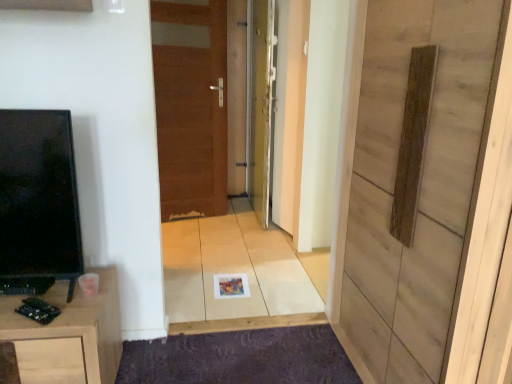
The height and width of the screenshot is (384, 512). Describe the element at coordinates (68, 335) in the screenshot. I see `wooden cabinet at lower left` at that location.

What do you see at coordinates (240, 358) in the screenshot? I see `purple textured mat at lower center` at bounding box center [240, 358].

The width and height of the screenshot is (512, 384). I want to click on metallic silver door at center, acting as the 2th door starting from the front, so click(261, 104).

Where is `wooden panel at center, arranged as the first door when viewed from the front`? wooden panel at center, arranged as the first door when viewed from the front is located at coordinates (420, 184).

What's the angular difference between brown wooden door at center, positioned as the 1th door in back-to-front order, and metallic silver door at center, which is the second door in left-to-right order,'s facing directions?

102 degrees.

Is brown wooden door at center, positioned as the 1th door in back-to-front order, thinner than metallic silver door at center, which is the second door in back-to-front order?

Indeed, brown wooden door at center, positioned as the 1th door in back-to-front order, has a lesser width compared to metallic silver door at center, which is the second door in back-to-front order.

Does brown wooden door at center, which is the 1th door in left-to-right order, appear on the right side of metallic silver door at center, which is the second door in back-to-front order?

No, brown wooden door at center, which is the 1th door in left-to-right order, is not to the right of metallic silver door at center, which is the second door in back-to-front order.

Measure the distance from brown wooden door at center, positioned as the 1th door in back-to-front order, to metallic silver door at center, which is the second door in left-to-right order.

A distance of 19.61 inches exists between brown wooden door at center, positioned as the 1th door in back-to-front order, and metallic silver door at center, which is the second door in left-to-right order.

Which of these two, wooden cabinet at lower left or wooden panel at center, which is counted as the third door, starting from the back, stands taller?

With more height is wooden panel at center, which is counted as the third door, starting from the back.

Does wooden cabinet at lower left have a lesser width compared to wooden panel at center, which is counted as the third door, starting from the back?

Yes.

Considering the relative sizes of wooden cabinet at lower left and wooden panel at center, which is counted as the third door, starting from the back, in the image provided, is wooden cabinet at lower left smaller than wooden panel at center, which is counted as the third door, starting from the back,?

Indeed, wooden cabinet at lower left has a smaller size compared to wooden panel at center, which is counted as the third door, starting from the back.

Considering the points (110, 332) and (303, 359), which point is behind, point (110, 332) or point (303, 359)?

Point (303, 359)

You are a GUI agent. You are given a task and a screenshot of the screen. Output one action in this format:
    pyautogui.click(x=<x>, y=<y>)
    Task: Click on the cabinetry in front of the purple textured mat at lower center
    
    Given the screenshot: What is the action you would take?
    pyautogui.click(x=68, y=335)

Between wooden cabinet at lower left and purple textured mat at lower center, which one has less height?

purple textured mat at lower center is shorter.

From a real-world perspective, starting from the purple textured mat at lower center, which door is the 3rd one vertically above it? Please provide its 2D coordinates.

[(261, 104)]

Is point (195, 375) farther from camera compared to point (270, 15)?

No.

Can you tell me how much purple textured mat at lower center and metallic silver door at center, which is the second door in left-to-right order, differ in facing direction?

89.8 degrees.

Is purple textured mat at lower center bigger or smaller than metallic silver door at center, which is the second door in left-to-right order?

Clearly, purple textured mat at lower center is smaller in size than metallic silver door at center, which is the second door in left-to-right order.

Which point is more forward, (262, 207) or (156, 345)?

Positioned in front is point (156, 345).

Is the position of metallic silver door at center, which appears as the second door when viewed from the right, more distant than that of purple textured mat at lower center?

Yes, it is behind purple textured mat at lower center.

From the image's perspective, which is above, metallic silver door at center, which is the second door in left-to-right order, or purple textured mat at lower center?

From the image's view, metallic silver door at center, which is the second door in left-to-right order, is above.

Does point (434, 35) lie behind point (60, 316)?

No, (434, 35) is in front of (60, 316).

From a real-world perspective, is wooden panel at center, arranged as the first door when viewed from the front, on wooden cabinet at lower left?

Yes, from a real-world perspective, wooden panel at center, arranged as the first door when viewed from the front, is on top of wooden cabinet at lower left.

Is wooden panel at center, which is counted as the third door, starting from the back, with wooden cabinet at lower left?

→ No, wooden panel at center, which is counted as the third door, starting from the back, is not making contact with wooden cabinet at lower left.

Based on their sizes in the image, would you say wooden panel at center, which is counted as the third door, starting from the back, is bigger or smaller than wooden cabinet at lower left?

wooden panel at center, which is counted as the third door, starting from the back, is bigger than wooden cabinet at lower left.

Locate an element on the screen. The height and width of the screenshot is (384, 512). the 2nd door directly beneath the metallic silver door at center, acting as the 2th door starting from the front (from a real-world perspective) is located at coordinates (420, 184).

Is metallic silver door at center, which is the second door in back-to-front order, not within wooden panel at center, arranged as the first door when viewed from the front?

Yes.

Considering the positions of objects metallic silver door at center, acting as the 2th door starting from the front, and wooden panel at center, which is counted as the third door, starting from the back, in the image provided, who is behind, metallic silver door at center, acting as the 2th door starting from the front, or wooden panel at center, which is counted as the third door, starting from the back,?

→ Positioned behind is metallic silver door at center, acting as the 2th door starting from the front.

From the image's perspective, which is below, metallic silver door at center, which appears as the second door when viewed from the right, or wooden panel at center, the first door when ordered from right to left?

wooden panel at center, the first door when ordered from right to left, appears lower in the image.

Image resolution: width=512 pixels, height=384 pixels. What are the coordinates of `door that is behind the metallic silver door at center, which is the second door in left-to-right order` in the screenshot? It's located at (191, 106).

At what (x,y) coordinates should I click in order to perform the action: click on cabinetry that is below the wooden panel at center, arranged as the first door when viewed from the front (from the image's perspective). Please return your answer as a coordinate pair (x, y). Image resolution: width=512 pixels, height=384 pixels. Looking at the image, I should click on (68, 335).

Which object lies nearer to the anchor point wooden panel at center, the first door when ordered from right to left, metallic silver door at center, which is the second door in back-to-front order, or brown wooden door at center, positioned as the 3th door in right-to-left order?

metallic silver door at center, which is the second door in back-to-front order, is closer to wooden panel at center, the first door when ordered from right to left.

Estimate the real-world distances between objects in this image. Which object is closer to wooden cabinet at lower left, purple textured mat at lower center or wooden panel at center, the first door when ordered from right to left?

purple textured mat at lower center is closer to wooden cabinet at lower left.

Which object lies nearer to the anchor point brown wooden door at center, positioned as the 3th door in right-to-left order, wooden panel at center, which is counted as the third door, starting from the back, or purple textured mat at lower center?

The object closer to brown wooden door at center, positioned as the 3th door in right-to-left order, is purple textured mat at lower center.

Based on the photo, looking at the image, which one is located closer to wooden cabinet at lower left, metallic silver door at center, which appears as the second door when viewed from the right, or purple textured mat at lower center?

purple textured mat at lower center is closer to wooden cabinet at lower left.

Based on their spatial positions, is purple textured mat at lower center or wooden panel at center, which is counted as the third door, starting from the back, further from metallic silver door at center, which is the second door in left-to-right order?

The object further to metallic silver door at center, which is the second door in left-to-right order, is wooden panel at center, which is counted as the third door, starting from the back.

Estimate the real-world distances between objects in this image. Which object is further from wooden cabinet at lower left, brown wooden door at center, which is the 1th door in left-to-right order, or wooden panel at center, arranged as the first door when viewed from the front?

brown wooden door at center, which is the 1th door in left-to-right order, is positioned further to the anchor wooden cabinet at lower left.

Based on their spatial positions, is brown wooden door at center, which is the 1th door in left-to-right order, or metallic silver door at center, acting as the 2th door starting from the front, closer to purple textured mat at lower center?

Based on the image, metallic silver door at center, acting as the 2th door starting from the front, appears to be nearer to purple textured mat at lower center.

Consider the image. Looking at the image, which one is located further to brown wooden door at center, placed as the third door when sorted from front to back, wooden panel at center, which is counted as the third door, starting from the back, or metallic silver door at center, which is the second door in back-to-front order?

Among the two, wooden panel at center, which is counted as the third door, starting from the back, is located further to brown wooden door at center, placed as the third door when sorted from front to back.

What are the coordinates of `cabinetry positioned between wooden panel at center, the first door when ordered from right to left, and brown wooden door at center, positioned as the 3th door in right-to-left order, from near to far` in the screenshot? It's located at (68, 335).

In order to click on doormat located between wooden cabinet at lower left and wooden panel at center, which is the 3th door from left to right, in the left-right direction in this screenshot , I will do [240, 358].

Locate an element on the screen. doormat between wooden panel at center, which is counted as the third door, starting from the back, and metallic silver door at center, acting as the 2th door starting from the front, in the front-back direction is located at coordinates (240, 358).

I want to click on doormat positioned between wooden cabinet at lower left and brown wooden door at center, positioned as the 3th door in right-to-left order, from near to far, so click(240, 358).